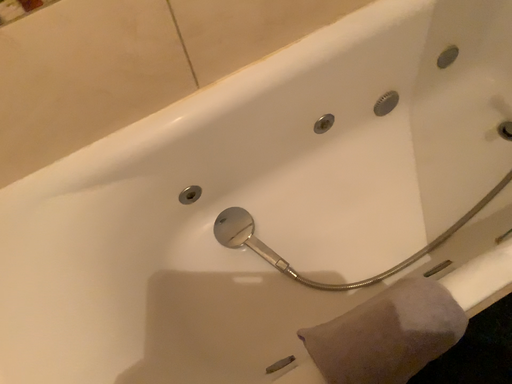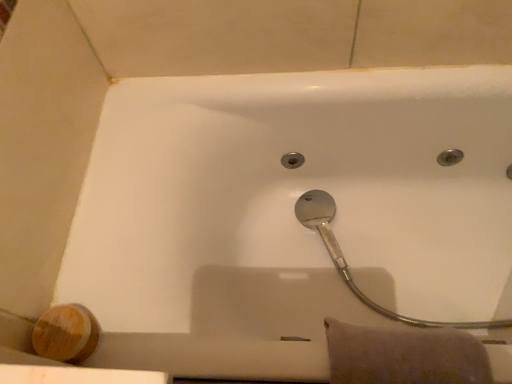
Question: How did the camera likely rotate when shooting the video?

Choices:
 (A) rotated left
 (B) rotated right

Answer: (A)